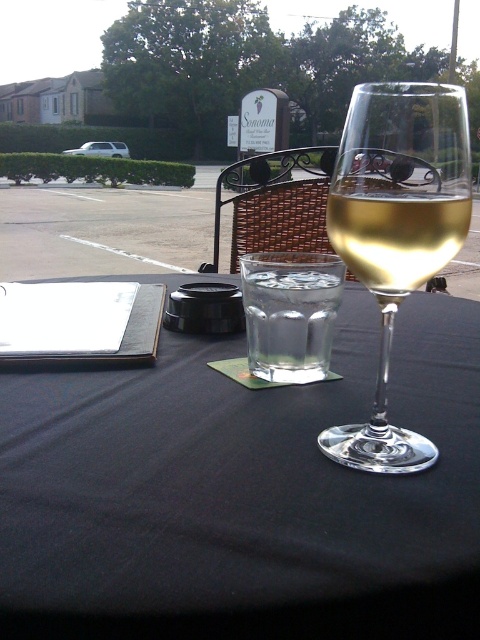
You are a guest at the Sonoma winery and want to pour yourself a glass of water. The clear glass wine glass at center is currently holding wine. How can you access the clear glass wine at center without disturbing the wine glass?

The clear glass wine at center is positioned above the clear glass wine glass at center, so you can pour water into the clear glass wine at center directly without moving the wine glass.

You are standing in front of the table with the dark blue tablecloth. You want to grab the clear glass table at center. Can you reach it without moving your position?

The clear glass table at center is 6.48 inches away from viewer, so yes, you can reach it without moving your position since it is within arm reach.

You are a guest at the winery and want to reach for the clear glass wine at center. However, there is a clear glass wine glass at center in the way. Can you easily access the wine?

The clear glass wine glass at center is in front of the clear glass wine at center, so you cannot easily access the wine because the glass is blocking it.